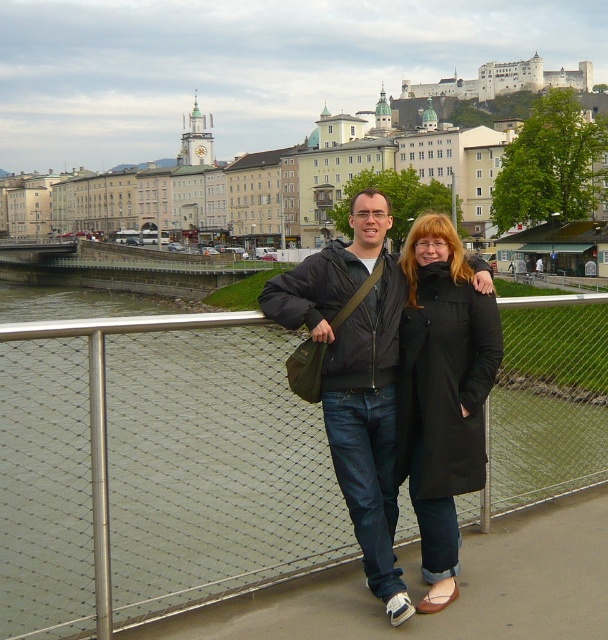
Question: Does black matte coat at center have a lesser width compared to black matte jacket at center?

Choices:
 (A) yes
 (B) no

Answer: (A)

Question: Which point is farther to the camera?

Choices:
 (A) black matte jacket at center
 (B) metal mesh fence at center

Answer: (A)

Question: Does black matte coat at center have a greater width compared to black matte jacket at center?

Choices:
 (A) yes
 (B) no

Answer: (B)

Question: Does metal mesh fence at center appear on the right side of black matte coat at center?

Choices:
 (A) no
 (B) yes

Answer: (B)

Question: Which object appears closest to the camera in this image?

Choices:
 (A) black matte jacket at center
 (B) metal mesh fence at center

Answer: (B)

Question: Considering the real-world distances, which object is farthest from the black matte jacket at center?

Choices:
 (A) black matte coat at center
 (B) metal mesh fence at center

Answer: (B)